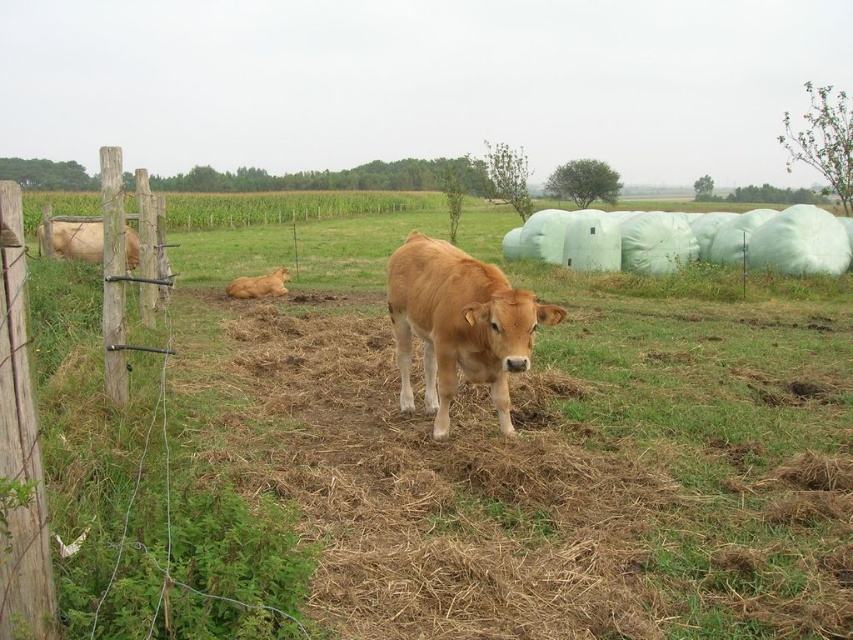
From the picture: Between golden smooth calf at center and brown wooden post at left, which one has more height?

With more height is golden smooth calf at center.

Is golden smooth calf at center thinner than brown wooden post at left?

No, golden smooth calf at center is not thinner than brown wooden post at left.

Which is in front, point (393, 289) or point (39, 572)?

Point (39, 572)

Find the location of a particular element. golden smooth calf at center is located at coordinates click(x=457, y=324).

Is brown grass at center taller than brown furry calf at lower left?

Correct, brown grass at center is much taller as brown furry calf at lower left.

Is brown grass at center further to camera compared to brown furry calf at lower left?

No, it is not.

Is point (711, 316) more distant than point (265, 275)?

That is False.

Where is `brown grass at center`? Image resolution: width=853 pixels, height=640 pixels. brown grass at center is located at coordinates (502, 464).

Is golden smooth calf at center behind light brown cow at left?

That is False.

Is golden smooth calf at center below light brown cow at left?

Indeed, golden smooth calf at center is positioned under light brown cow at left.

Find the location of a particular element. The height and width of the screenshot is (640, 853). golden smooth calf at center is located at coordinates (457, 324).

This screenshot has width=853, height=640. Identify the location of golden smooth calf at center. (457, 324).